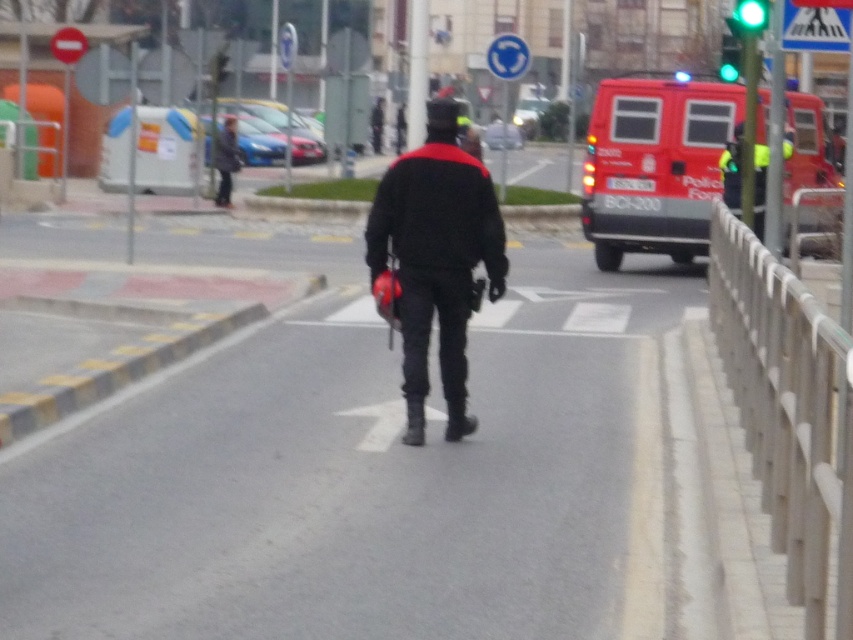
Which is below, dark gray fabric jacket at upper left or green glass traffic light at upper center?

dark gray fabric jacket at upper left is below.

Measure the distance between point (221, 166) and camera.

They are 27.13 meters apart.

Looking at this image, who is more forward, (235, 145) or (758, 19)?

Positioned in front is point (758, 19).

Identify the location of dark gray fabric jacket at upper left. (225, 161).

Does matte black helmet at center appear under black matte helmet at upper center?

Indeed, matte black helmet at center is positioned under black matte helmet at upper center.

How distant is matte black helmet at center from black matte helmet at upper center?

They are 38.58 meters apart.

Which is in front, point (424, 355) or point (370, 115)?

Point (424, 355)

Locate an element on the screen. This screenshot has width=853, height=640. matte black helmet at center is located at coordinates (434, 260).

Is point (221, 184) positioned in front of point (399, 129)?

Yes.

Does dark gray fabric jacket at upper left have a greater width compared to black matte helmet at center?

Yes, dark gray fabric jacket at upper left is wider than black matte helmet at center.

Which is behind, point (231, 173) or point (399, 145)?

The point (399, 145) is more distant.

This screenshot has width=853, height=640. In order to click on dark gray fabric jacket at upper left in this screenshot , I will do `click(225, 161)`.